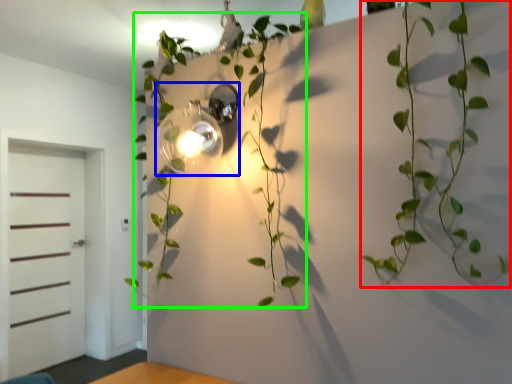
Question: Considering the real-world distances, which object is closest to houseplant (highlighted by a red box)? light fixture (highlighted by a blue box) or plant (highlighted by a green box).

Choices:
 (A) light fixture
 (B) plant

Answer: (B)